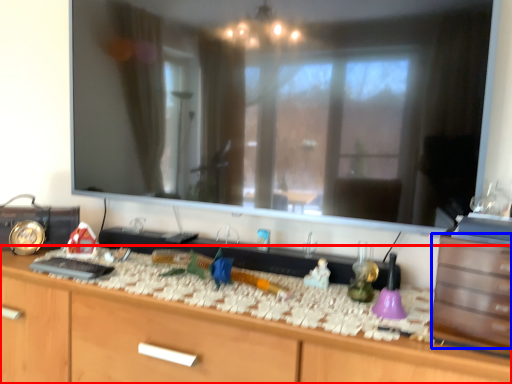
Question: Which of the following is the closest to the observer, cabinetry (highlighted by a red box) or drawer (highlighted by a blue box)?

Choices:
 (A) cabinetry
 (B) drawer

Answer: (A)